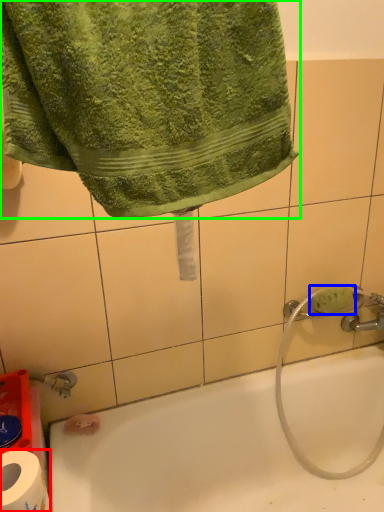
Question: Which object is the farthest from toilet paper (highlighted by a red box)? Choose among these: soap (highlighted by a blue box) or towel (highlighted by a green box).

Choices:
 (A) soap
 (B) towel

Answer: (A)